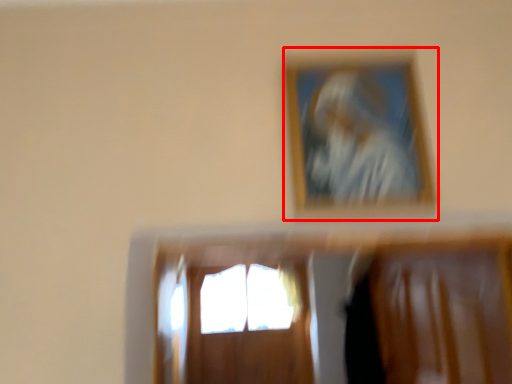
Question: In this image, where is picture frame (annotated by the red box) located relative to window?

Choices:
 (A) left
 (B) right

Answer: (B)